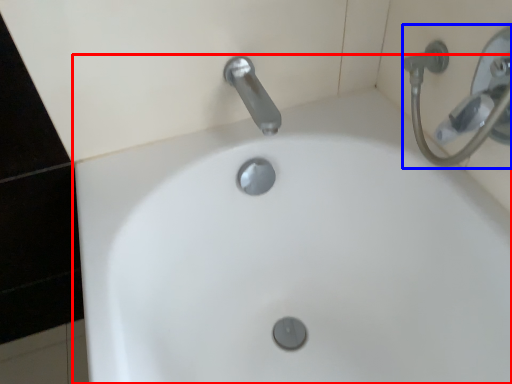
Question: Among these objects, which one is nearest to the camera, sink (highlighted by a red box) or shower (highlighted by a blue box)?

Choices:
 (A) sink
 (B) shower

Answer: (A)